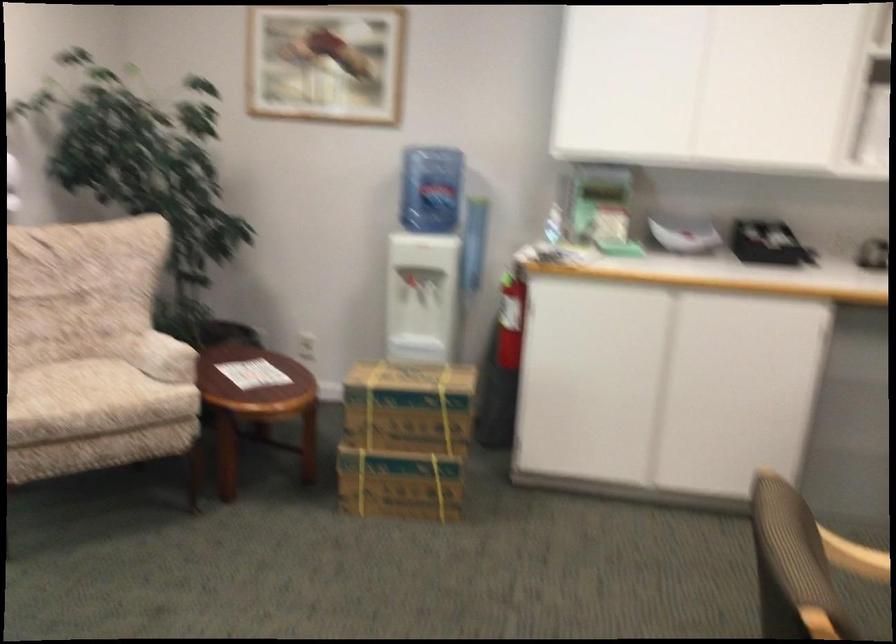
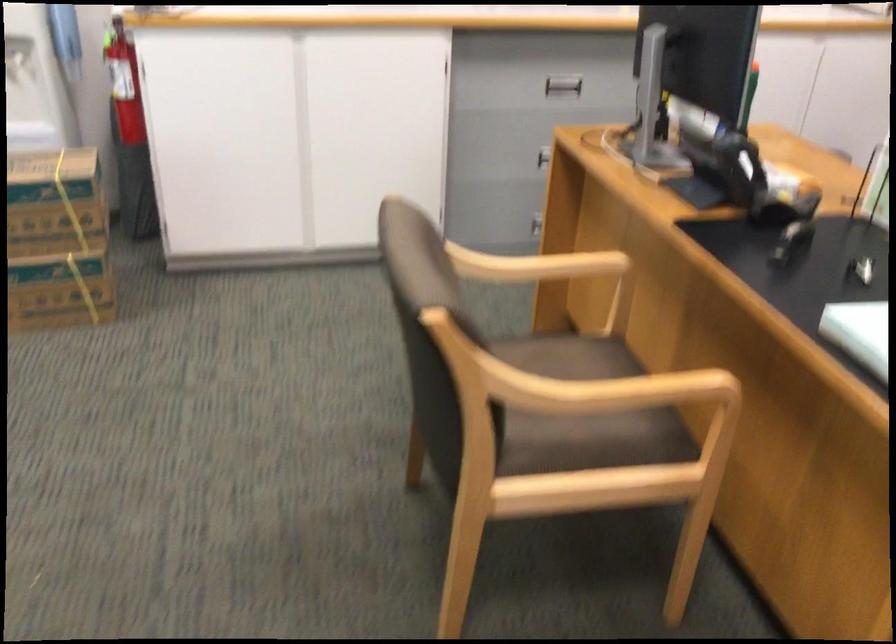
Based on the photo, based on the continuous images, in which direction is the camera rotating?

The camera rotated toward right-down.